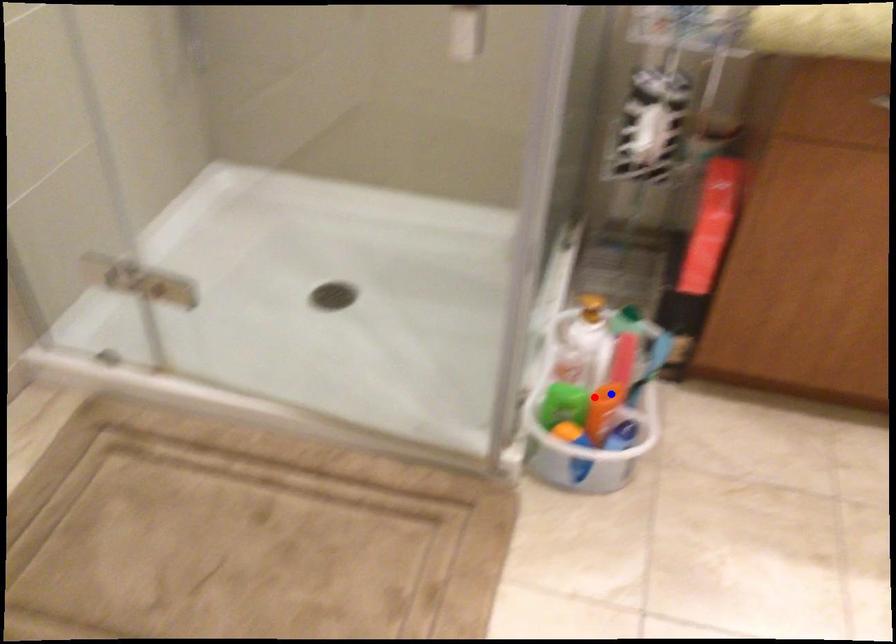
Question: Two points are marked on the image. Which point is closer to the camera?

Choices:
 (A) Blue point is closer.
 (B) Red point is closer.

Answer: (B)